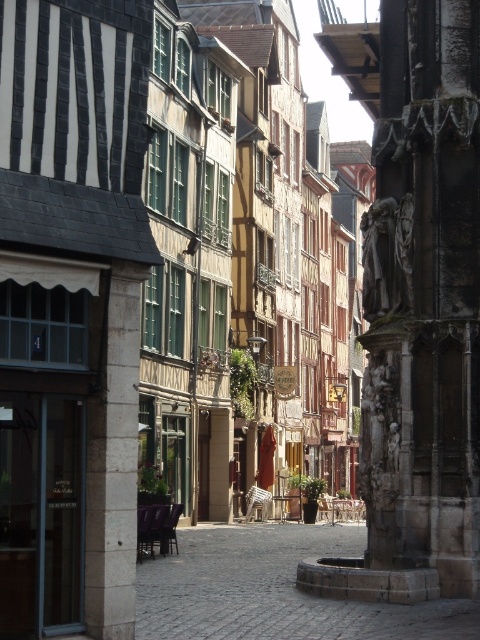
Question: Among these points, which one is nearest to the camera?

Choices:
 (A) (212, 556)
 (B) (434, 244)

Answer: (B)

Question: Does dark stone sculpture at right have a larger size compared to brown cobblestone alley at center?

Choices:
 (A) no
 (B) yes

Answer: (A)

Question: Among these points, which one is farthest from the camera?

Choices:
 (A) (393, 358)
 (B) (159, 588)

Answer: (A)

Question: Is dark stone sculpture at right to the left of brown cobblestone alley at center from the viewer's perspective?

Choices:
 (A) yes
 (B) no

Answer: (B)

Question: Can you confirm if dark stone sculpture at right is positioned below brown cobblestone alley at center?

Choices:
 (A) yes
 (B) no

Answer: (B)